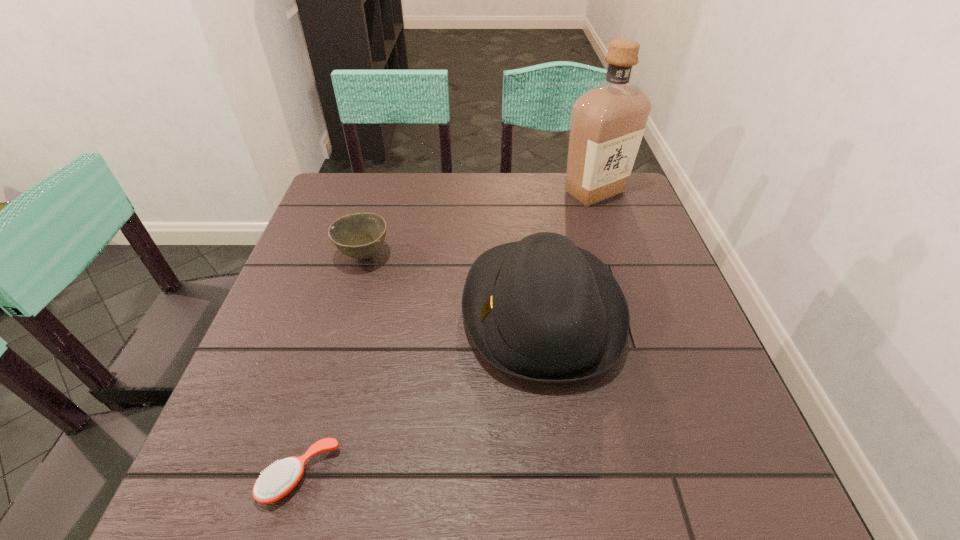
The width and height of the screenshot is (960, 540). I want to click on vacant space situated on the right of the bowl, so click(500, 255).

Find the location of `vacant position located 0.250m on the right of the shortest object`. vacant position located 0.250m on the right of the shortest object is located at coordinates (496, 475).

The width and height of the screenshot is (960, 540). What are the coordinates of `object that is at the far edge` in the screenshot? It's located at (608, 121).

Find the location of a particular element. The image size is (960, 540). object that is at the near edge is located at coordinates (278, 480).

In order to click on bowl that is at the left edge in this screenshot , I will do `click(360, 235)`.

Find the location of a particular element. The width and height of the screenshot is (960, 540). hairbrush located at the left edge is located at coordinates (278, 480).

I want to click on liquor located in the right edge section of the desktop, so click(x=608, y=121).

You are a GUI agent. You are given a task and a screenshot of the screen. Output one action in this format:
    pyautogui.click(x=<x>, y=<y>)
    Task: Click on the fedora present at the right edge
    
    Given the screenshot: What is the action you would take?
    pyautogui.click(x=541, y=309)

Locate an element on the screen. object at the near left corner is located at coordinates (278, 480).

Where is `object that is at the far right corner`? This screenshot has height=540, width=960. object that is at the far right corner is located at coordinates (608, 121).